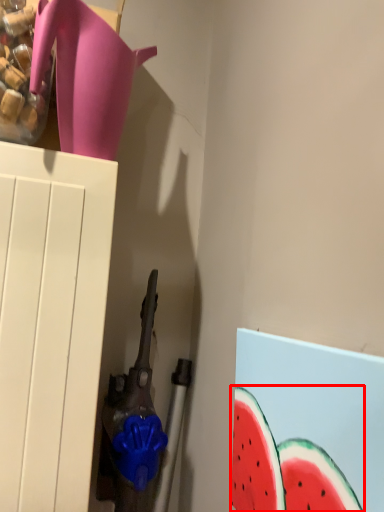
Question: From the image's perspective, what is the correct spatial relationship of watermelon (annotated by the red box) in relation to jug?

Choices:
 (A) below
 (B) above

Answer: (A)